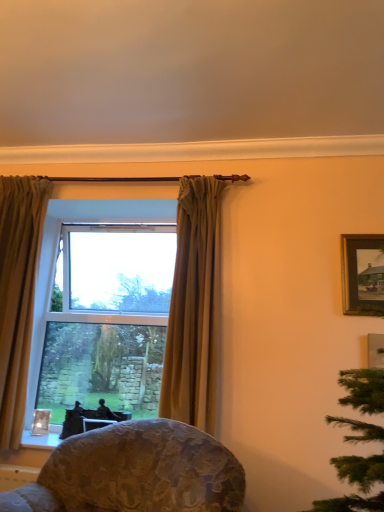
Question: Is wooden framed painting at upper right turned away from matte gold curtain at center, marked as the 1th curtain in a right-to-left arrangement?

Choices:
 (A) no
 (B) yes

Answer: (A)

Question: Can we say wooden framed painting at upper right lies outside matte gold curtain at center, marked as the 1th curtain in a right-to-left arrangement?

Choices:
 (A) yes
 (B) no

Answer: (A)

Question: From a real-world perspective, is wooden framed painting at upper right physically below matte gold curtain at center, the 2th curtain positioned from the left?

Choices:
 (A) yes
 (B) no

Answer: (B)

Question: From the image's perspective, is wooden framed painting at upper right on top of matte gold curtain at center, the 2th curtain positioned from the left?

Choices:
 (A) yes
 (B) no

Answer: (A)

Question: From a real-world perspective, is wooden framed painting at upper right on top of matte gold curtain at center, marked as the 1th curtain in a right-to-left arrangement?

Choices:
 (A) no
 (B) yes

Answer: (B)

Question: Could you tell me if wooden framed painting at upper right is turned towards matte gold curtain at center, marked as the 1th curtain in a right-to-left arrangement?

Choices:
 (A) no
 (B) yes

Answer: (A)

Question: Considering the relative sizes of floral fabric chair at lower center and gold textured curtain at left, arranged as the 2th curtain when viewed from the right, in the image provided, is floral fabric chair at lower center thinner than gold textured curtain at left, arranged as the 2th curtain when viewed from the right,?

Choices:
 (A) no
 (B) yes

Answer: (A)

Question: Is floral fabric chair at lower center behind gold textured curtain at left, the first curtain positioned from the left?

Choices:
 (A) no
 (B) yes

Answer: (A)

Question: Is floral fabric chair at lower center positioned before gold textured curtain at left, the first curtain positioned from the left?

Choices:
 (A) yes
 (B) no

Answer: (A)

Question: Is floral fabric chair at lower center oriented towards gold textured curtain at left, arranged as the 2th curtain when viewed from the right?

Choices:
 (A) no
 (B) yes

Answer: (A)

Question: Is floral fabric chair at lower center directly adjacent to gold textured curtain at left, arranged as the 2th curtain when viewed from the right?

Choices:
 (A) no
 (B) yes

Answer: (A)

Question: Is there a large distance between floral fabric chair at lower center and gold textured curtain at left, the first curtain positioned from the left?

Choices:
 (A) yes
 (B) no

Answer: (A)

Question: From the image's perspective, is floral fabric chair at lower center on clear glass window at center?

Choices:
 (A) no
 (B) yes

Answer: (A)